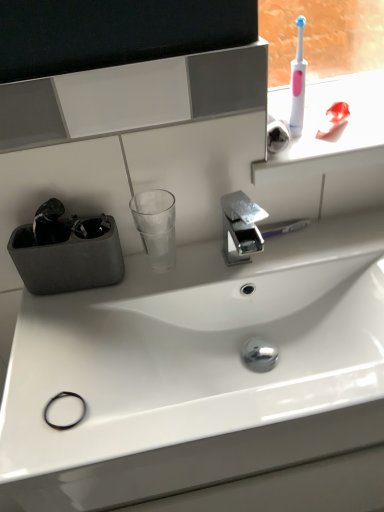
At what (x,y) coordinates should I click in order to perform the action: click on vacant area that is situated to the right of transparent glass at center. Please return your answer as a coordinate pair (x, y). This screenshot has height=512, width=384. Looking at the image, I should click on (231, 258).